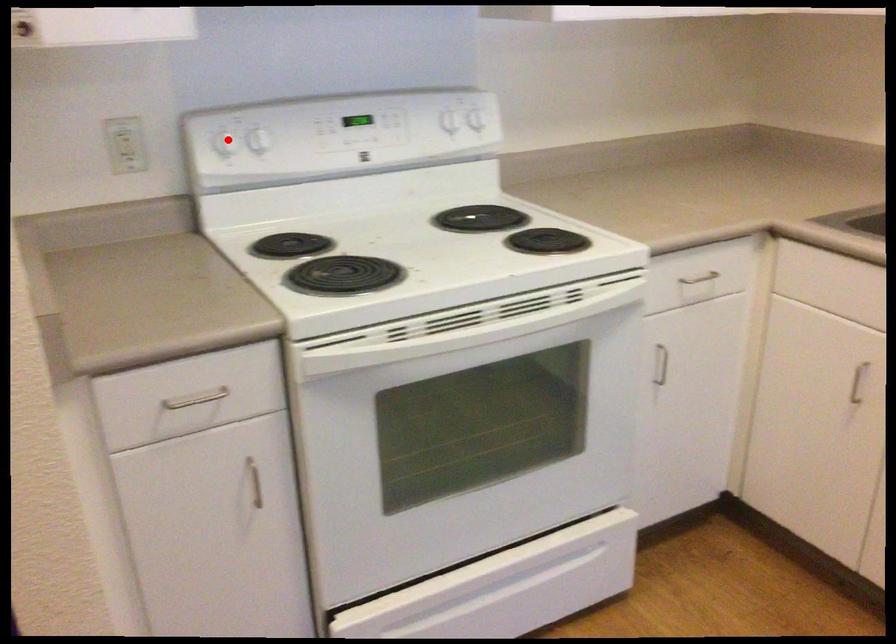
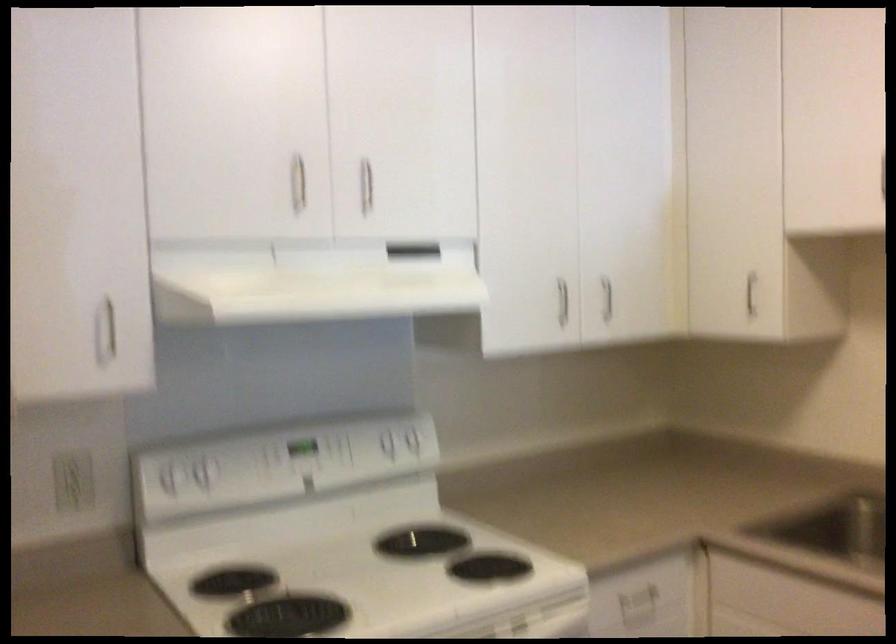
Find the pixel in the second image that matches the highlighted location in the first image.

(169, 476)